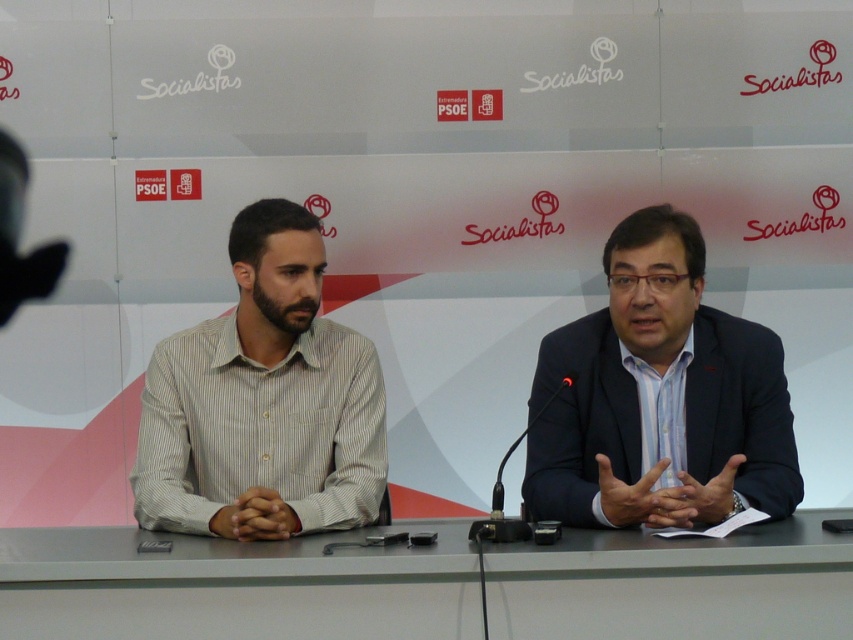
Question: Based on their relative distances, which object is farther from the gray/matte table at center?

Choices:
 (A) blue striped shirt at center
 (B) striped cotton shirt at left

Answer: (B)

Question: Which of the following is the farthest from the observer?

Choices:
 (A) (602, 385)
 (B) (199, 509)
 (C) (180, 608)

Answer: (A)

Question: Does gray/matte table at center have a lesser width compared to blue striped shirt at center?

Choices:
 (A) no
 (B) yes

Answer: (A)

Question: Is gray/matte table at center below striped cotton shirt at left?

Choices:
 (A) no
 (B) yes

Answer: (B)

Question: Can you confirm if gray/matte table at center is positioned above striped cotton shirt at left?

Choices:
 (A) no
 (B) yes

Answer: (A)

Question: Which point is farther to the camera?

Choices:
 (A) gray/matte table at center
 (B) blue striped shirt at center

Answer: (B)